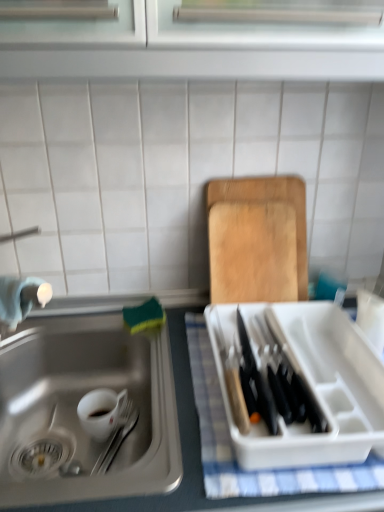
Question: Considering the relative sizes of white checkered cloth at right and white glossy mug at lower left in the image provided, is white checkered cloth at right smaller than white glossy mug at lower left?

Choices:
 (A) yes
 (B) no

Answer: (B)

Question: Does white checkered cloth at right have a larger size compared to white glossy mug at lower left?

Choices:
 (A) no
 (B) yes

Answer: (B)

Question: Does white checkered cloth at right have a lesser width compared to white glossy mug at lower left?

Choices:
 (A) no
 (B) yes

Answer: (A)

Question: Is white checkered cloth at right at the right side of white glossy mug at lower left?

Choices:
 (A) no
 (B) yes

Answer: (B)

Question: Considering the relative sizes of white checkered cloth at right and white glossy mug at lower left in the image provided, is white checkered cloth at right wider than white glossy mug at lower left?

Choices:
 (A) no
 (B) yes

Answer: (B)

Question: Is white checkered cloth at right turned away from white glossy mug at lower left?

Choices:
 (A) yes
 (B) no

Answer: (B)

Question: Is white glossy mug at lower left completely or partially inside wooden cutting board at upper right?

Choices:
 (A) yes
 (B) no

Answer: (B)

Question: Is wooden cutting board at upper right oriented towards white glossy mug at lower left?

Choices:
 (A) no
 (B) yes

Answer: (A)

Question: Can you confirm if wooden cutting board at upper right is thinner than white glossy mug at lower left?

Choices:
 (A) no
 (B) yes

Answer: (B)

Question: Can you confirm if wooden cutting board at upper right is bigger than white glossy mug at lower left?

Choices:
 (A) no
 (B) yes

Answer: (B)

Question: Is wooden cutting board at upper right outside white glossy mug at lower left?

Choices:
 (A) yes
 (B) no

Answer: (A)

Question: Is the depth of wooden cutting board at upper right greater than that of white glossy mug at lower left?

Choices:
 (A) yes
 (B) no

Answer: (A)

Question: Is stainless steel sink at lower left further to camera compared to wooden cutting board at upper right?

Choices:
 (A) yes
 (B) no

Answer: (B)